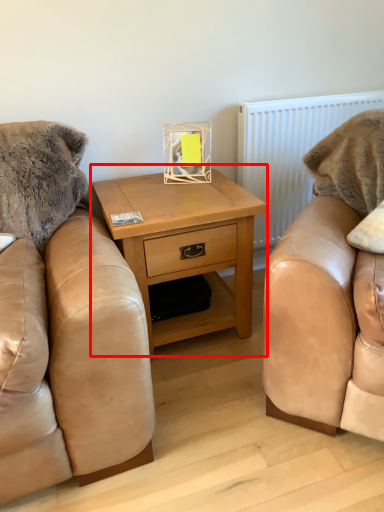
Question: From the image's perspective, where is nightstand (annotated by the red box) located relative to radiator?

Choices:
 (A) below
 (B) above

Answer: (A)